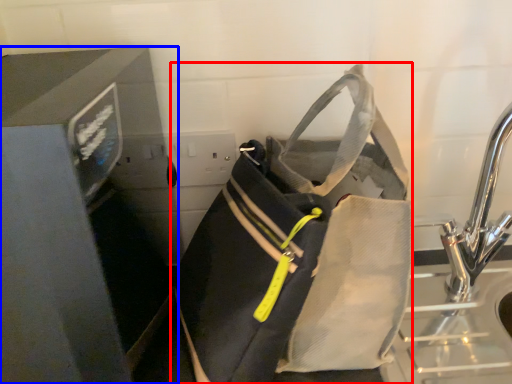
Question: Among these objects, which one is farthest to the camera, luggage and bags (highlighted by a red box) or appliance (highlighted by a blue box)?

Choices:
 (A) luggage and bags
 (B) appliance

Answer: (A)